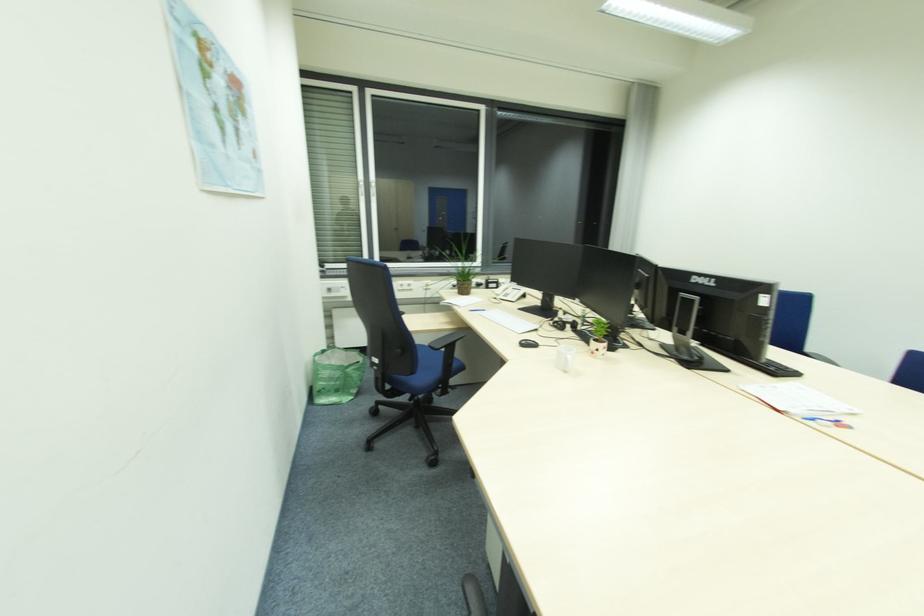
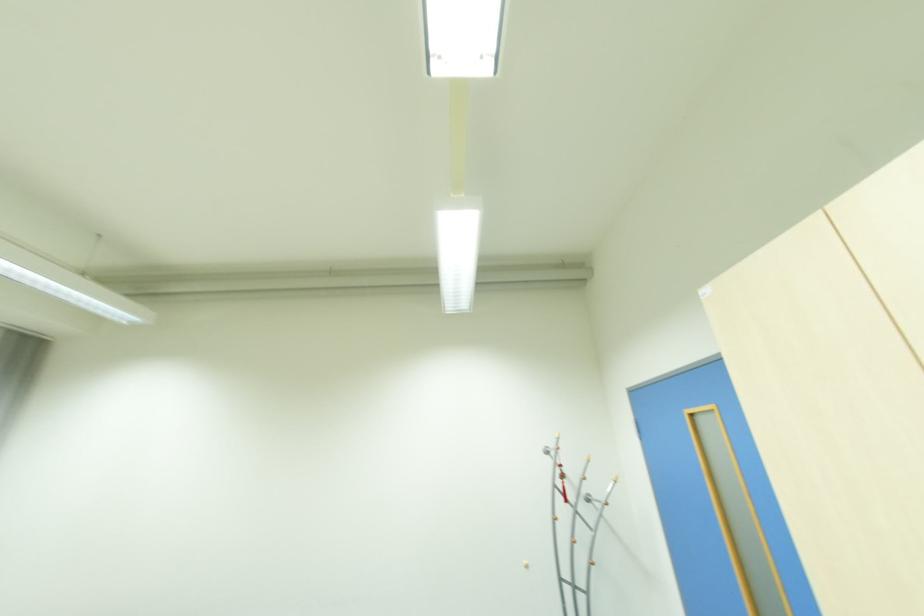
How did the camera likely rotate?

The rotation direction of the camera is right-up.